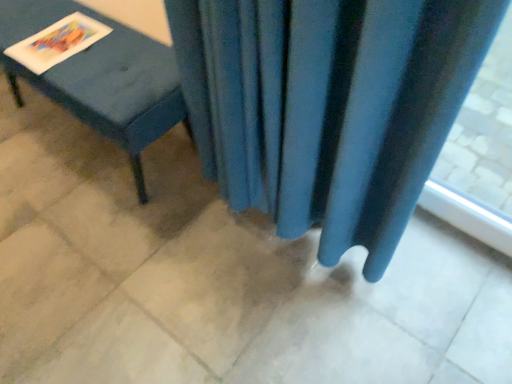
The height and width of the screenshot is (384, 512). What do you see at coordinates (102, 78) in the screenshot?
I see `velvet blue table at left` at bounding box center [102, 78].

I want to click on velvet blue table at left, so click(x=102, y=78).

Identify the location of velvet blue table at left. coord(102,78).